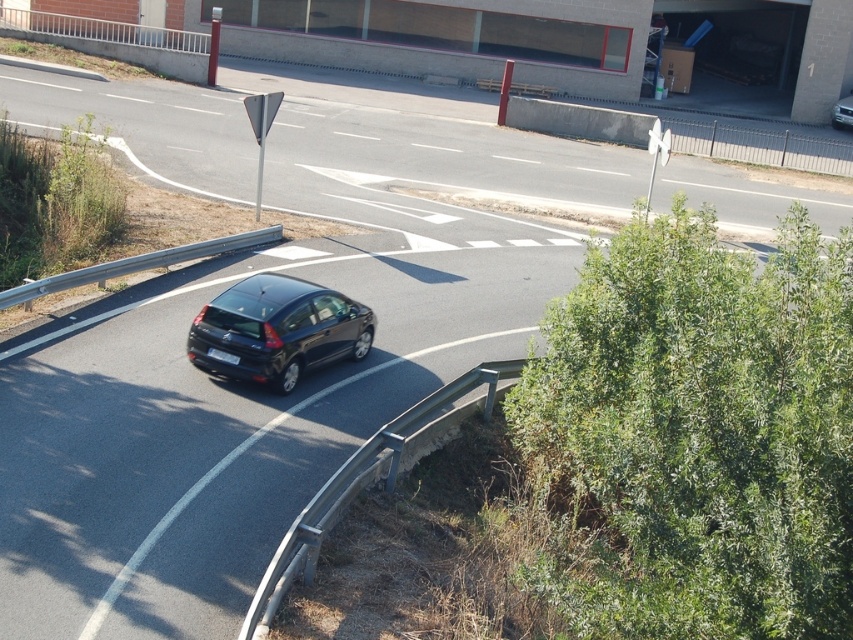
Which of these two, smooth asphalt road at center or black plastic license plate at center, stands taller?

With more height is smooth asphalt road at center.

Looking at this image, is smooth asphalt road at center to the right of black plastic license plate at center from the viewer's perspective?

Yes, smooth asphalt road at center is to the right of black plastic license plate at center.

The height and width of the screenshot is (640, 853). What do you see at coordinates (444, 156) in the screenshot?
I see `smooth asphalt road at center` at bounding box center [444, 156].

You are a GUI agent. You are given a task and a screenshot of the screen. Output one action in this format:
    pyautogui.click(x=<x>, y=<y>)
    Task: Click on the smooth asphalt road at center
    This screenshot has width=853, height=640.
    Given the screenshot: What is the action you would take?
    pyautogui.click(x=444, y=156)

Which is more to the right, glossy black hatchback at center or black plastic license plate at center?

Positioned to the right is glossy black hatchback at center.

Image resolution: width=853 pixels, height=640 pixels. Find the location of `glossy black hatchback at center`. glossy black hatchback at center is located at coordinates (277, 330).

Which of these two, smooth asphalt road at center or glossy black hatchback at center, stands shorter?

glossy black hatchback at center

Is smooth asphalt road at center shorter than glossy black hatchback at center?

In fact, smooth asphalt road at center may be taller than glossy black hatchback at center.

Identify the location of smooth asphalt road at center. (444, 156).